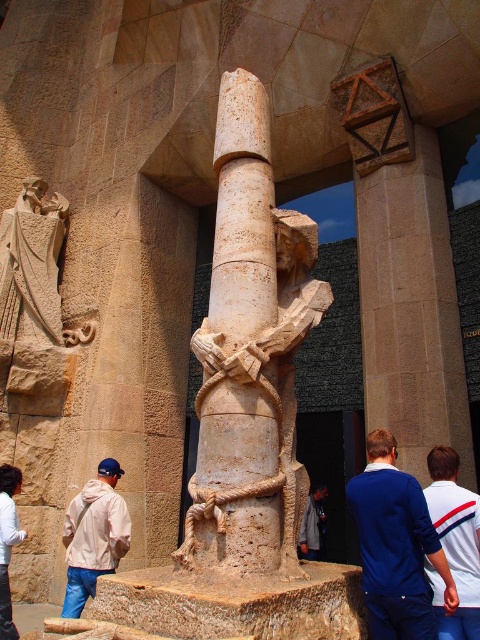
Question: Is white cotton shirt at lower left to the right of dark gray fabric at center from the viewer's perspective?

Choices:
 (A) yes
 (B) no

Answer: (B)

Question: In this image, where is beige stone column at center located relative to white jersey at center?

Choices:
 (A) above
 (B) below

Answer: (A)

Question: Which is farther from the dark gray fabric at center?

Choices:
 (A) beige fabric jacket at lower left
 (B) white jersey at center
 (C) blue cotton shirt at center

Answer: (A)

Question: Is beige stone column at center to the left of beige fabric jacket at lower left from the viewer's perspective?

Choices:
 (A) yes
 (B) no

Answer: (B)

Question: Which of the following is the farthest from the observer?

Choices:
 (A) (412, 612)
 (B) (13, 468)
 (C) (97, 556)
 (D) (244, 141)

Answer: (B)

Question: Which point is farther to the camera?

Choices:
 (A) (320, 518)
 (B) (403, 480)

Answer: (A)